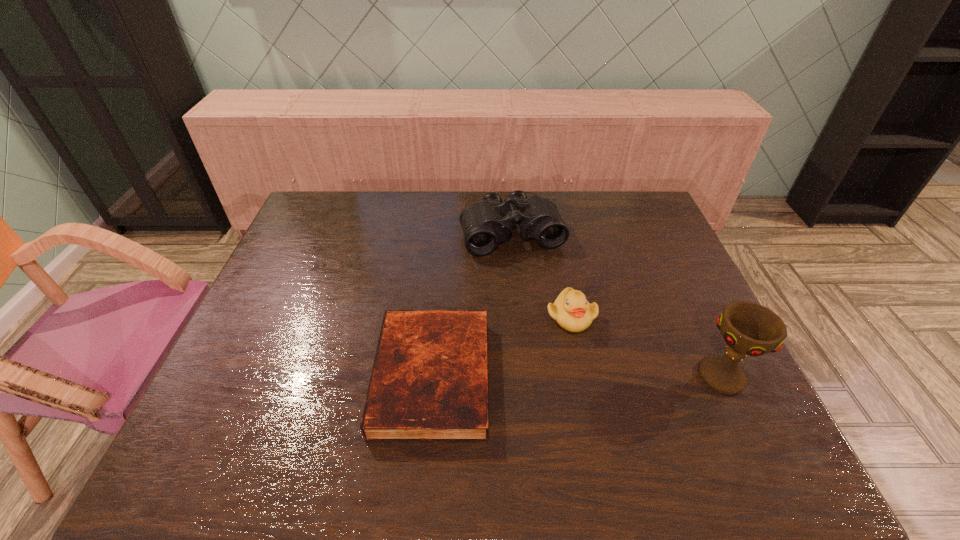
The width and height of the screenshot is (960, 540). I want to click on free spot on the desktop that is between the Bible and the chalice and is positioned at the eyepieces of the second tallest object, so click(563, 376).

Identify the location of free spot on the desktop that is between the Bible and the chalice and is positioned at the face of the second shortest object. (612, 376).